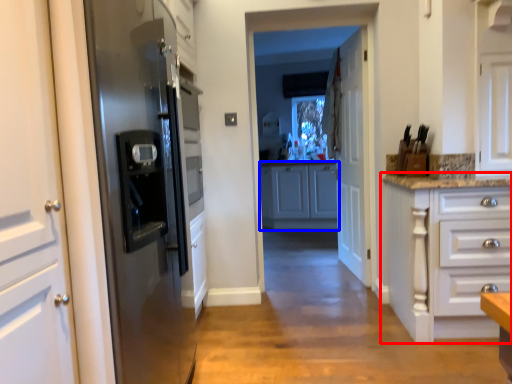
Question: Which point is further to the camera, cabinetry (highlighted by a red box) or cabinetry (highlighted by a blue box)?

Choices:
 (A) cabinetry
 (B) cabinetry

Answer: (B)